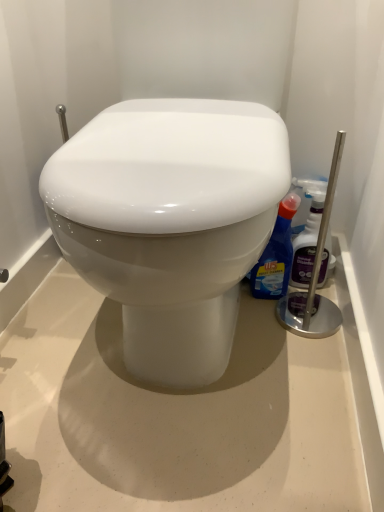
Locate an element on the screen. free space in front of blue glossy toilet cleaner at right, marked as the 2th cleaning product in a right-to-left arrangement is located at coordinates (284, 334).